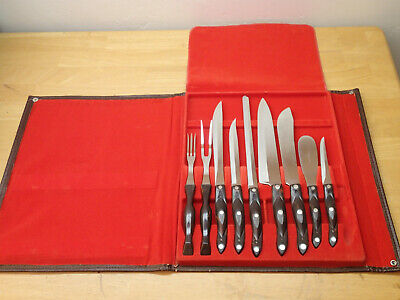
Where is `utensils`? utensils is located at coordinates (188, 218), (205, 217), (220, 215), (240, 218), (255, 215), (280, 218), (299, 217), (315, 214), (330, 208).